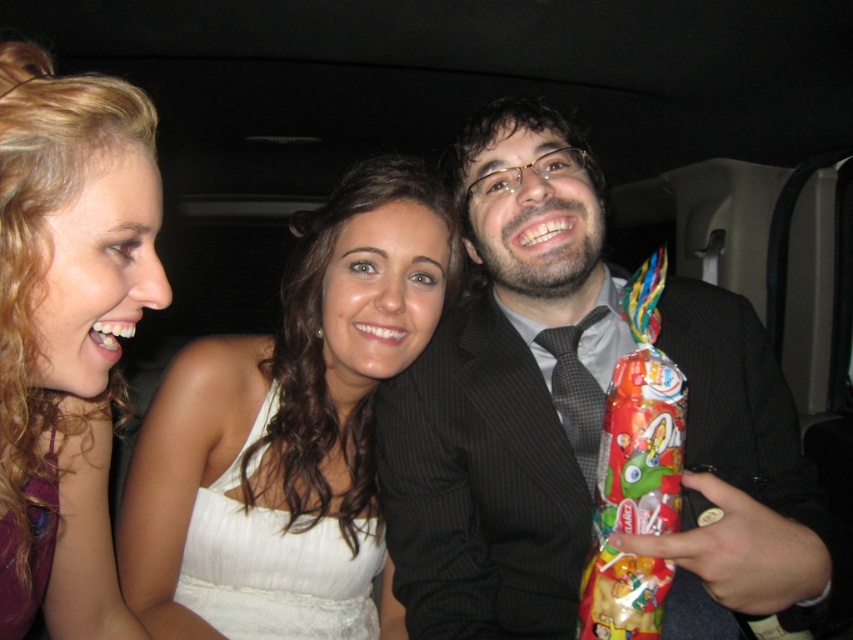
Question: Is the position of black pinstripe suit at center less distant than that of blonde curly hair at upper left?

Choices:
 (A) yes
 (B) no

Answer: (B)

Question: Which point is closer to the camera?

Choices:
 (A) (386, 616)
 (B) (24, 204)

Answer: (B)

Question: Which object is positioned closest to the blonde curly hair at upper left?

Choices:
 (A) black pinstripe suit at center
 (B) white satin dress at center

Answer: (B)

Question: Can you confirm if black pinstripe suit at center is positioned above blonde curly hair at upper left?

Choices:
 (A) no
 (B) yes

Answer: (A)

Question: Is black pinstripe suit at center to the right of white satin dress at center from the viewer's perspective?

Choices:
 (A) yes
 (B) no

Answer: (A)

Question: Which object is closer to the camera taking this photo?

Choices:
 (A) blonde curly hair at upper left
 (B) white satin dress at center
 (C) black pinstripe suit at center

Answer: (A)